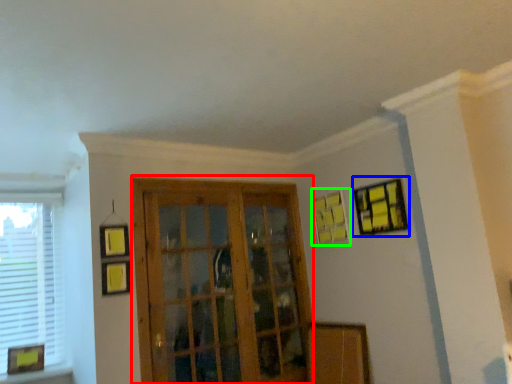
Question: Which is nearer to the screen door (highlighted by a red box)? picture frame (highlighted by a blue box) or picture frame (highlighted by a green box).

Choices:
 (A) picture frame
 (B) picture frame

Answer: (B)